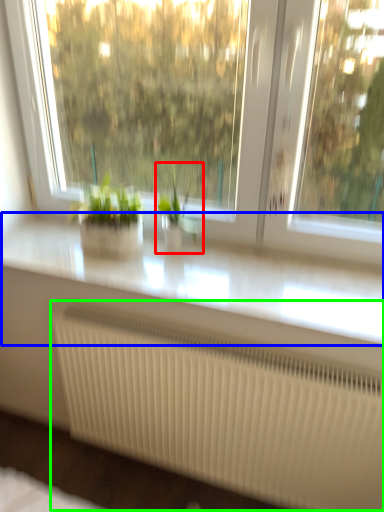
Question: Estimate the real-world distances between objects in this image. Which object is closer to houseplant (highlighted by a red box), counter top (highlighted by a blue box) or radiator (highlighted by a green box)?

Choices:
 (A) counter top
 (B) radiator

Answer: (A)